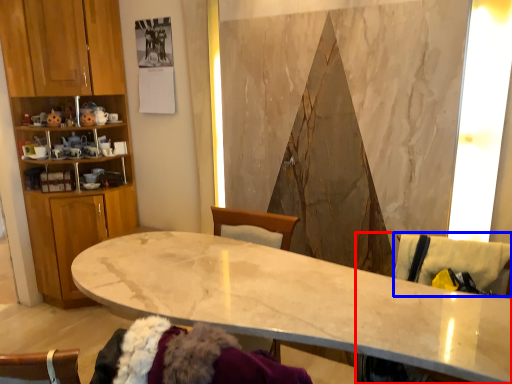
Question: Which object is further to the camera taking this photo, swivel chair (highlighted by a red box) or swivel chair (highlighted by a blue box)?

Choices:
 (A) swivel chair
 (B) swivel chair

Answer: (B)